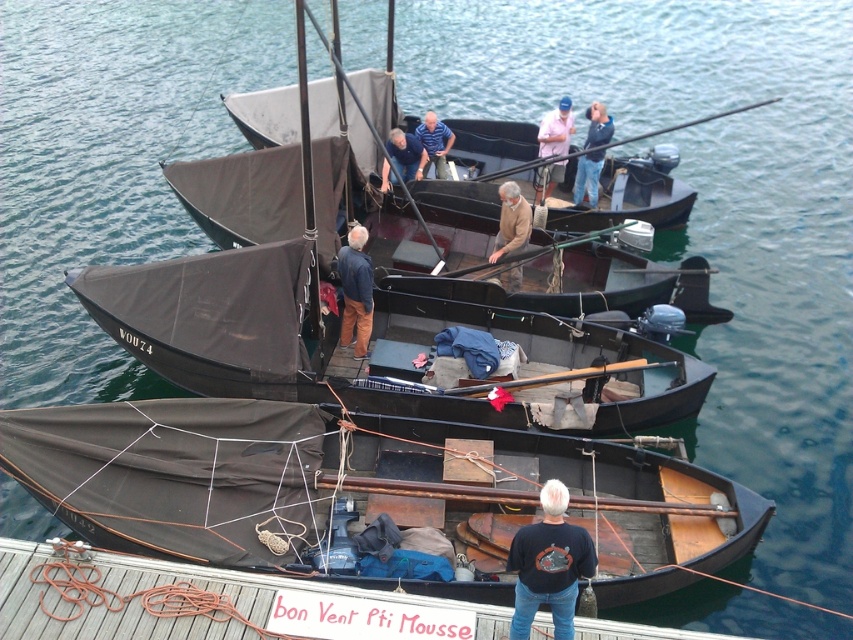
Does dark brown canvas boat at center have a lesser height compared to black cotton shirt at lower center?

Yes, dark brown canvas boat at center is shorter than black cotton shirt at lower center.

Can you confirm if dark brown canvas boat at center is bigger than black cotton shirt at lower center?

Actually, dark brown canvas boat at center might be smaller than black cotton shirt at lower center.

Is point (289, 147) positioned in front of point (566, 532)?

No, it is behind (566, 532).

I want to click on dark brown canvas boat at center, so click(x=241, y=193).

Between dark brown canvas boat at lower center and dark brown canvas boat at center, which one is positioned higher?

dark brown canvas boat at center is above.

Which is behind, point (238, 496) or point (357, 161)?

The point (357, 161) is more distant.

Locate an element on the screen. This screenshot has height=640, width=853. dark brown canvas boat at lower center is located at coordinates (364, 490).

Based on the photo, which is more to the left, matte black sailboat at center or wooden dock at lower left?

Positioned to the left is wooden dock at lower left.

Does matte black sailboat at center have a greater height compared to wooden dock at lower left?

In fact, matte black sailboat at center may be shorter than wooden dock at lower left.

Between point (490, 413) and point (218, 637), which one is positioned behind?

The point (490, 413) is behind.

The height and width of the screenshot is (640, 853). What are the coordinates of `matte black sailboat at center` in the screenshot? It's located at (351, 348).